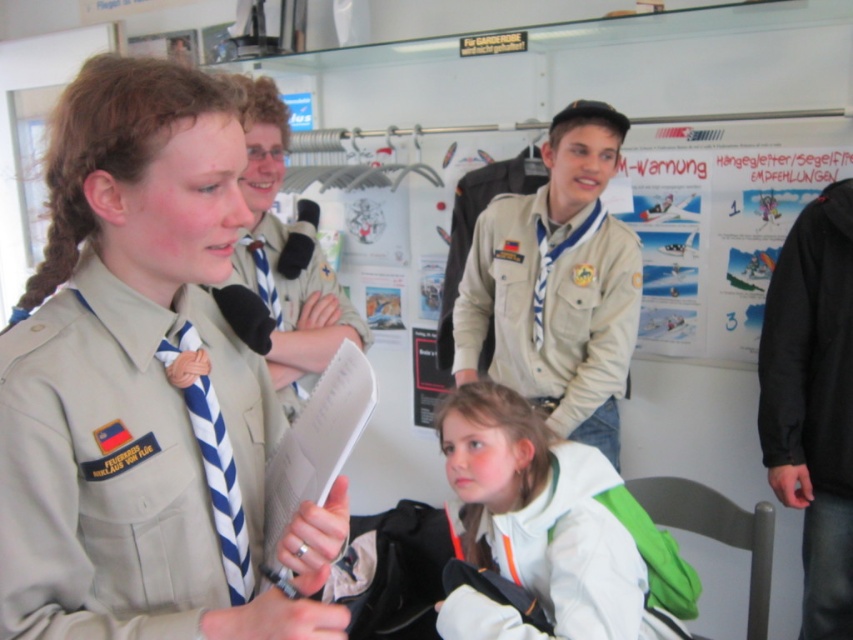
Question: Does khaki fabric uniform at center appear on the right side of blue/white striped tie at center?

Choices:
 (A) yes
 (B) no

Answer: (A)

Question: Which object is the closest to the white paper clipboard at center?

Choices:
 (A) white fabric jacket at lower center
 (B) blue/white striped tie at center

Answer: (B)

Question: Is white paper clipboard at center thinner than blue and white striped tie at center?

Choices:
 (A) yes
 (B) no

Answer: (B)

Question: Among these objects, which one is farthest from the camera?

Choices:
 (A) black matte jacket at right
 (B) blue/white striped tie at center

Answer: (A)

Question: Estimate the real-world distances between objects in this image. Which object is farther from the white paper clipboard at center?

Choices:
 (A) black matte jacket at right
 (B) blue/white striped tie at center
 (C) beige fabric uniform at center

Answer: (A)

Question: Does white paper clipboard at center appear over blue/white striped tie at center?

Choices:
 (A) yes
 (B) no

Answer: (B)